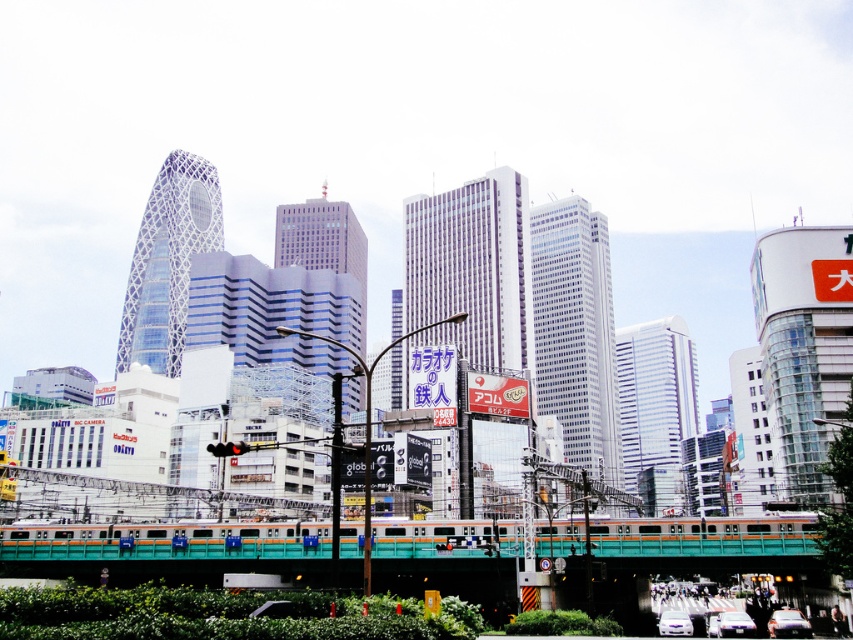
You are a pedestrian standing at the intersection near the white glossy car at lower right and the teal glossy train at center. You want to cross the road to the park on the other side. Which object should you wait behind to ensure safety?

You should wait behind the white glossy car at lower right because it is positioned behind the teal glossy train at center, providing a safer spot away from the train tracks.

You are a photographer standing at the camera position. You want to take a photo of both point (808, 636) and point (746, 614) in the scene. Which point will appear larger in your photo?

Point (808, 636) is closer to the camera than point (746, 614), so it will appear larger in the photo.

You are a pedestrian standing at the edge of the bridge in the scene. You see the teal glossy train at center and the shiny silver sedan at center. Can you safely cross between them without getting hit, considering their distance apart?

The teal glossy train at center and shiny silver sedan at center are 54.08 feet apart from each other. Since the distance between them is 54.08 feet, which is more than enough for a pedestrian to safely cross between them without getting hit.